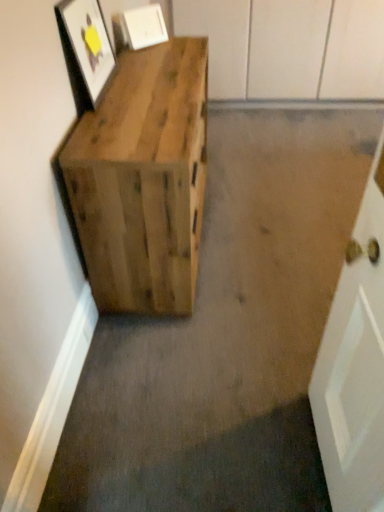
Locate an element on the screen. vacant space in front of natural wood crate at left is located at coordinates (206, 362).